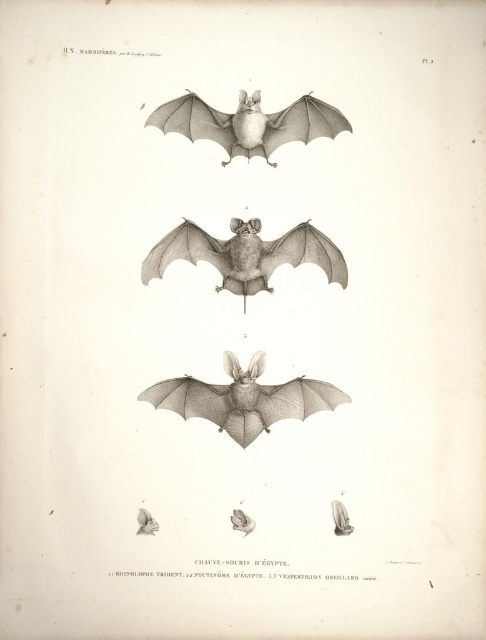
Question: Which point appears closest to the camera in this image?

Choices:
 (A) (224, 276)
 (B) (332, 406)
 (C) (173, 106)

Answer: (C)

Question: Which object appears closest to the camera in this image?

Choices:
 (A) smooth gray bat at center
 (B) matte gray wing at upper center

Answer: (A)

Question: Is gray pencil sketch bat at center in front of matte gray wing at upper center?

Choices:
 (A) yes
 (B) no

Answer: (B)

Question: Can you confirm if smooth gray bat at center is bigger than matte gray wing at upper center?

Choices:
 (A) no
 (B) yes

Answer: (B)

Question: Which object is positioned closest to the smooth gray bat at center?

Choices:
 (A) matte gray wing at upper center
 (B) gray pencil sketch bat at center

Answer: (B)

Question: Is smooth gray bat at center to the right of gray pencil sketch bat at center from the viewer's perspective?

Choices:
 (A) yes
 (B) no

Answer: (A)